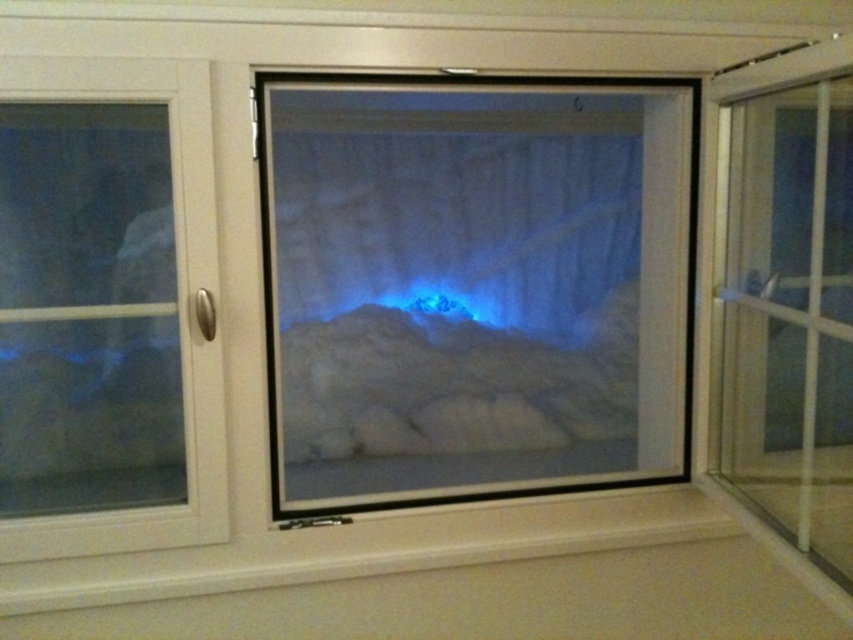
Which is more to the right, transparent glass screen door at center or transparent glass door at right?

Positioned to the right is transparent glass door at right.

Is transparent glass screen door at center smaller than transparent glass door at right?

No.

Identify the location of transparent glass screen door at center. tap(474, 285).

Where is `transparent glass screen door at center`? This screenshot has width=853, height=640. transparent glass screen door at center is located at coordinates (474, 285).